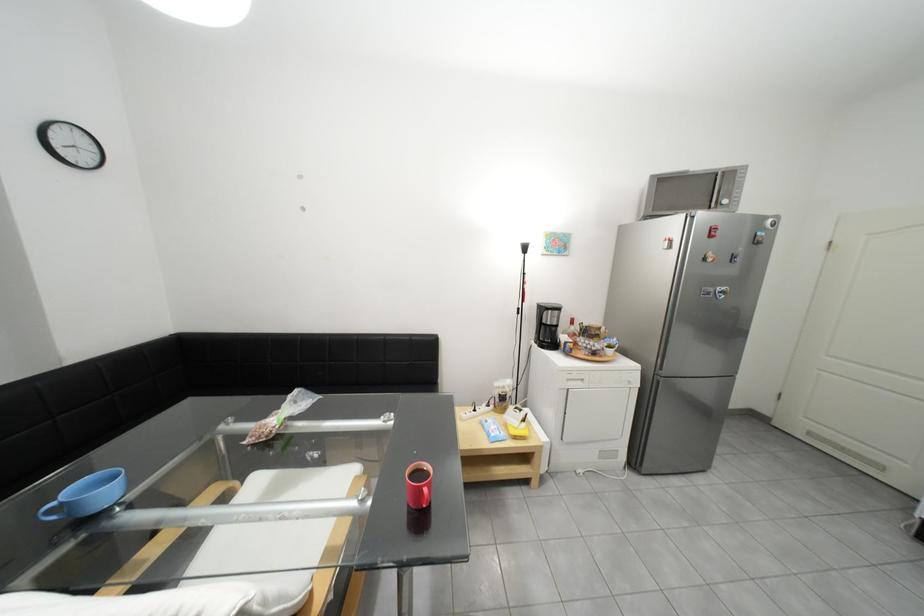
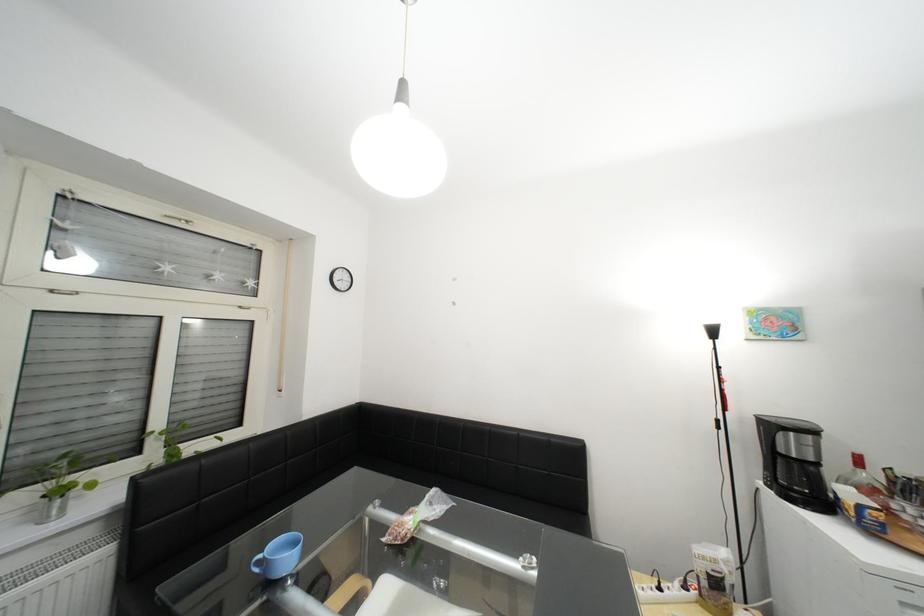
Find the pixel in the second image that matches (528,304) in the first image.

(723, 411)